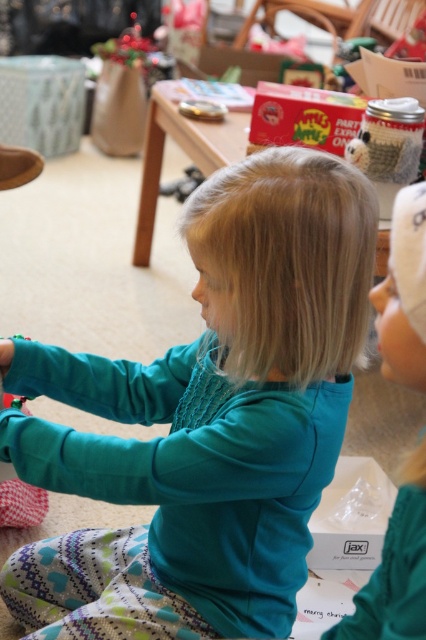
Does point (242, 600) come behind point (391, 330)?

That is True.

Who is positioned more to the left, teal soft shirt at center or teal fabric toddler at center?

teal soft shirt at center

Between point (52, 369) and point (394, 321), which one is positioned behind?

Positioned behind is point (52, 369).

Locate an element on the screen. The image size is (426, 640). teal soft shirt at center is located at coordinates (207, 419).